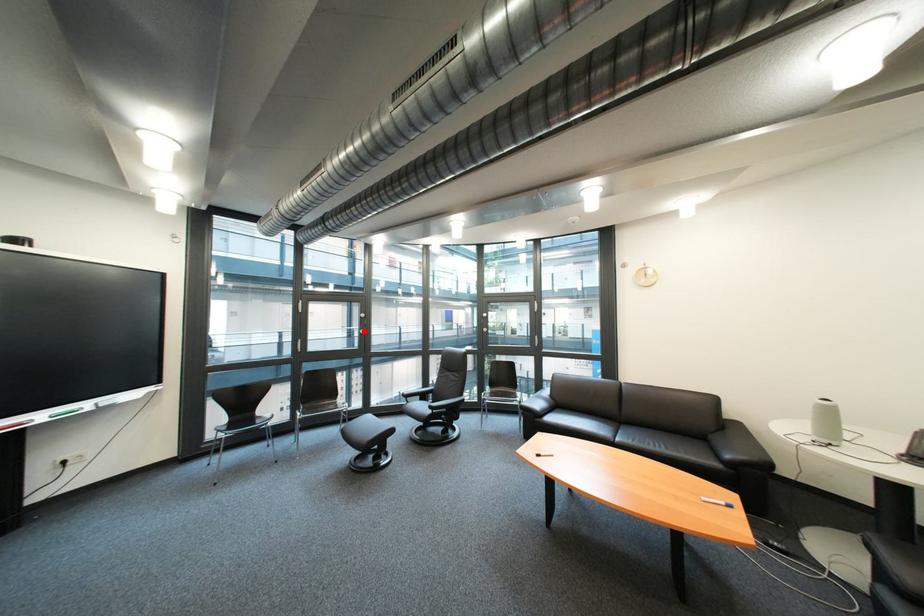
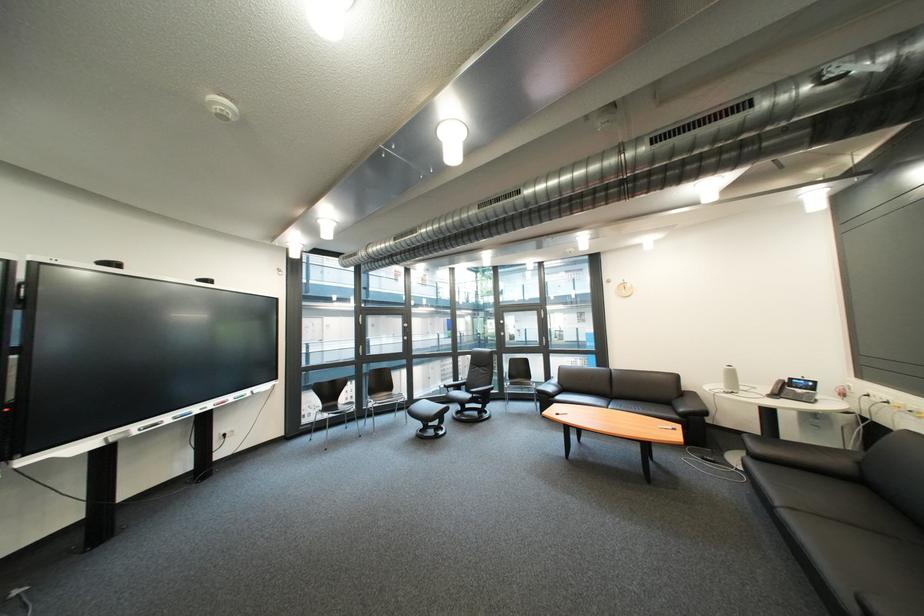
Question: I am providing you with two images of the same scene from different viewpoints. A red point is marked on the first image. Is the red point's position out of view in image 2?

Choices:
 (A) Yes
 (B) No

Answer: (A)